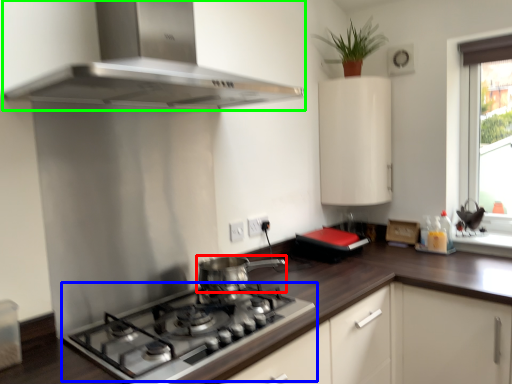
Question: Estimate the real-world distances between objects in this image. Which object is farther from kitchen appliance (highlighted by a red box), gas stove (highlighted by a blue box) or home appliance (highlighted by a green box)?

Choices:
 (A) gas stove
 (B) home appliance

Answer: (B)